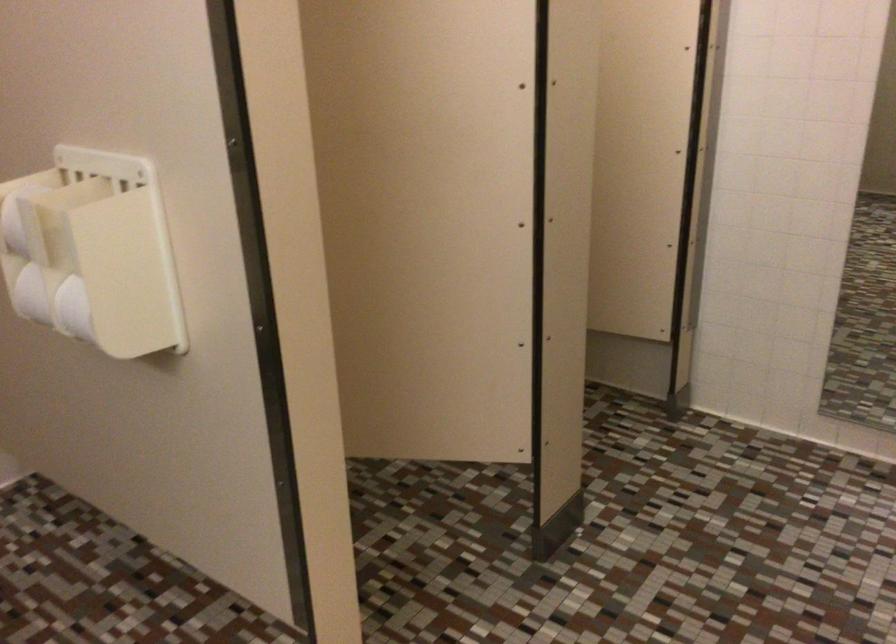
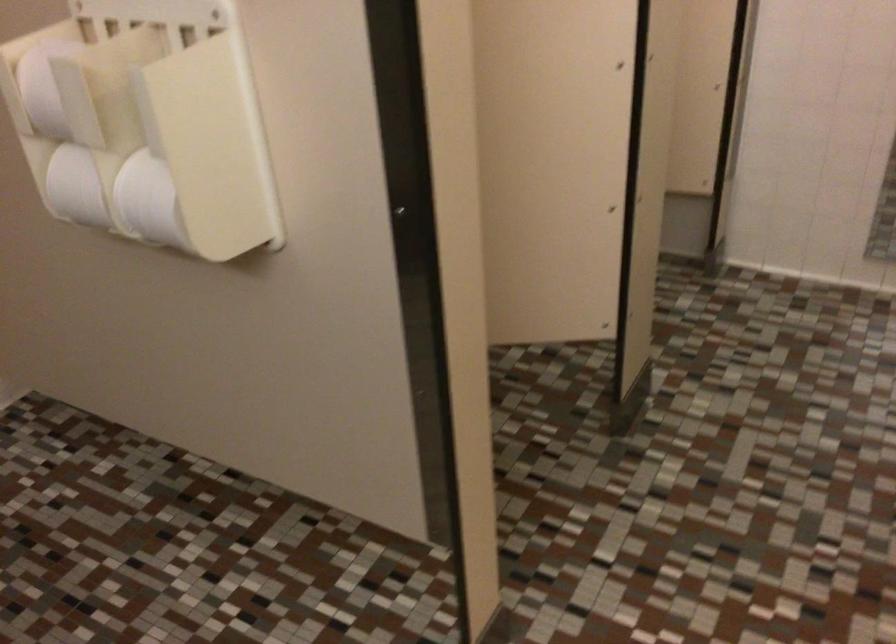
What movement of the cameraman would produce the second image?

The movement direction of the cameraman is left, forward.